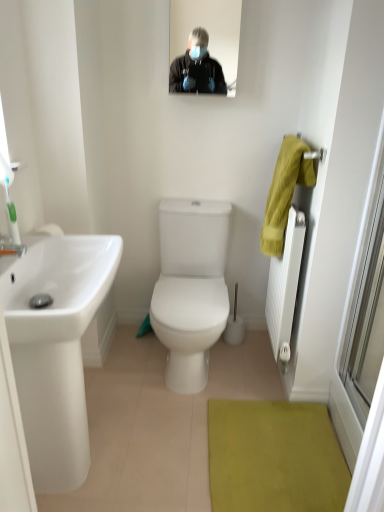
Question: From a real-world perspective, is white glossy sink at left positioned above or below matte black mirror at upper center?

Choices:
 (A) below
 (B) above

Answer: (A)

Question: From their relative heights in the image, would you say white glossy sink at left is taller or shorter than matte black mirror at upper center?

Choices:
 (A) tall
 (B) short

Answer: (A)

Question: Which is farther from the matte black mirror at upper center?

Choices:
 (A) white glossy sink at left
 (B) yellow fabric hand towel at right
 (C) white textured radiator at right
 (D) green textured bath mat at lower center
 (E) transparent glass door at right

Answer: (D)

Question: Which is farther from the transparent glass door at right?

Choices:
 (A) white textured radiator at right
 (B) green textured bath mat at lower center
 (C) white glossy sink at left
 (D) yellow fabric hand towel at right
 (E) matte black mirror at upper center

Answer: (E)